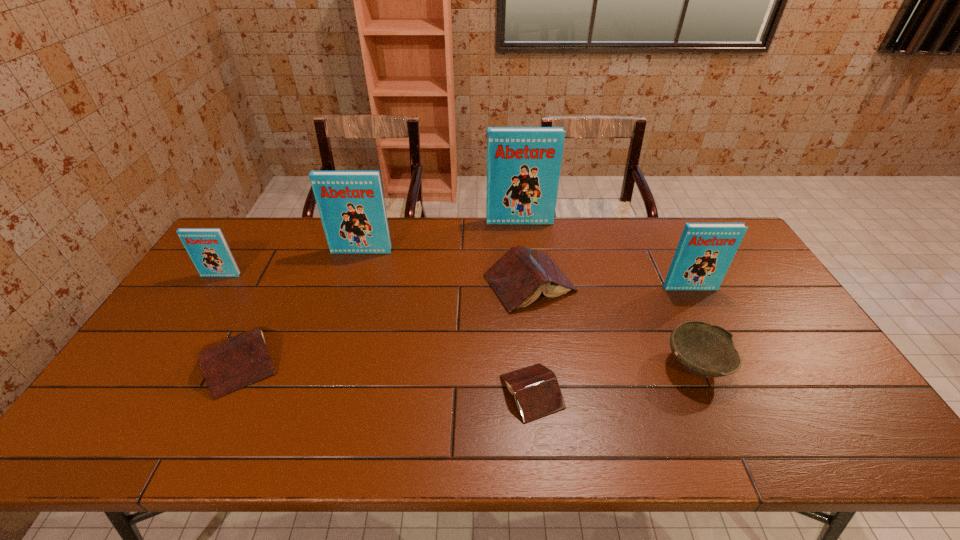
Locate an element on the screen. The image size is (960, 540). free space between the seventh tallest object and the shortest object is located at coordinates (386, 376).

Where is `empty space that is in between the second shortest book and the second farthest blue book`? This screenshot has width=960, height=540. empty space that is in between the second shortest book and the second farthest blue book is located at coordinates (300, 306).

Identify the location of vacant area that lies between the shortest object and the second biggest brown book. This screenshot has height=540, width=960. (386, 376).

The height and width of the screenshot is (540, 960). I want to click on free space between the third shortest book and the bowl, so click(x=612, y=324).

This screenshot has height=540, width=960. Find the location of `empty space that is in between the second biggest brown book and the bowl`. empty space that is in between the second biggest brown book and the bowl is located at coordinates (468, 363).

This screenshot has height=540, width=960. Identify the location of free spot between the biggest blue book and the bowl. (608, 293).

Identify the location of the third closest object relative to the smallest blue book. The image size is (960, 540). click(518, 278).

Where is `the second closest object to the bowl`? This screenshot has width=960, height=540. the second closest object to the bowl is located at coordinates (518, 278).

I want to click on book that is the sixth closest one to the smallest brown book, so click(207, 247).

Identify the location of book that is the sixth closest to the second tallest object. Image resolution: width=960 pixels, height=540 pixels. (705, 251).